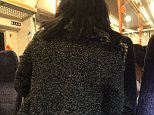
Where is `chairs`? chairs is located at coordinates (5, 83), (130, 78), (149, 82), (140, 53), (145, 48).